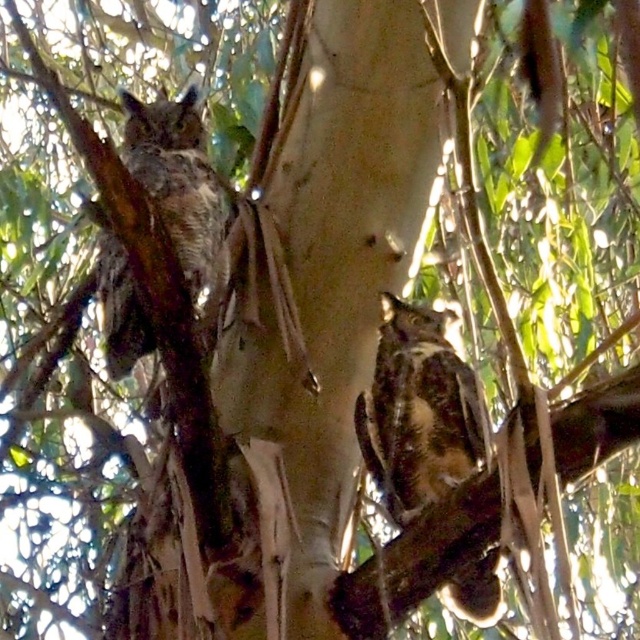
Question: Which point is farther from the camera taking this photo?

Choices:
 (A) (150, 161)
 (B) (433, 403)

Answer: (A)

Question: Can you confirm if brown speckled owl at center is positioned to the right of brown speckled owl at left?

Choices:
 (A) yes
 (B) no

Answer: (A)

Question: Does brown speckled owl at center have a larger size compared to brown speckled owl at left?

Choices:
 (A) yes
 (B) no

Answer: (B)

Question: Is brown speckled owl at center smaller than brown speckled owl at left?

Choices:
 (A) yes
 (B) no

Answer: (A)

Question: Which object is closer to the camera taking this photo?

Choices:
 (A) brown speckled owl at center
 (B) brown speckled owl at left

Answer: (B)